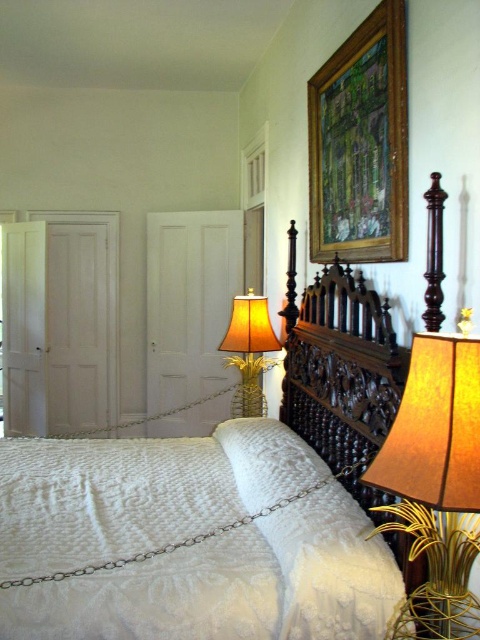
Question: Considering the real-world distances, which object is farthest from the gold metallic pineapple at center?

Choices:
 (A) wooden picture frame at upper center
 (B) gold textured lampshade at right
 (C) white quilted fabric bed at center

Answer: (B)

Question: Can you confirm if white quilted fabric bed at center is positioned to the left of gold metallic pineapple at center?

Choices:
 (A) no
 (B) yes

Answer: (B)

Question: Estimate the real-world distances between objects in this image. Which object is farther from the white quilted fabric bed at center?

Choices:
 (A) wooden picture frame at upper center
 (B) gold metallic pineapple at center
 (C) gold textured lampshade at right

Answer: (B)

Question: Does wooden picture frame at upper center have a smaller size compared to gold metallic pineapple at center?

Choices:
 (A) no
 (B) yes

Answer: (B)

Question: Considering the relative positions of white quilted fabric bed at center and gold metallic pineapple at center in the image provided, where is white quilted fabric bed at center located with respect to gold metallic pineapple at center?

Choices:
 (A) below
 (B) above

Answer: (A)

Question: Which object is positioned closest to the gold metallic pineapple at center?

Choices:
 (A) wooden picture frame at upper center
 (B) gold textured lampshade at right

Answer: (A)